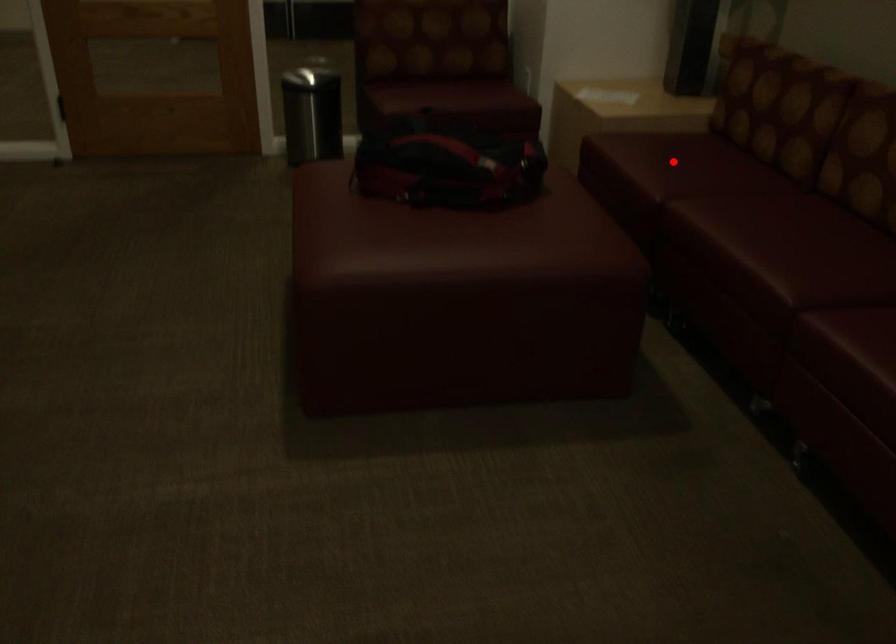
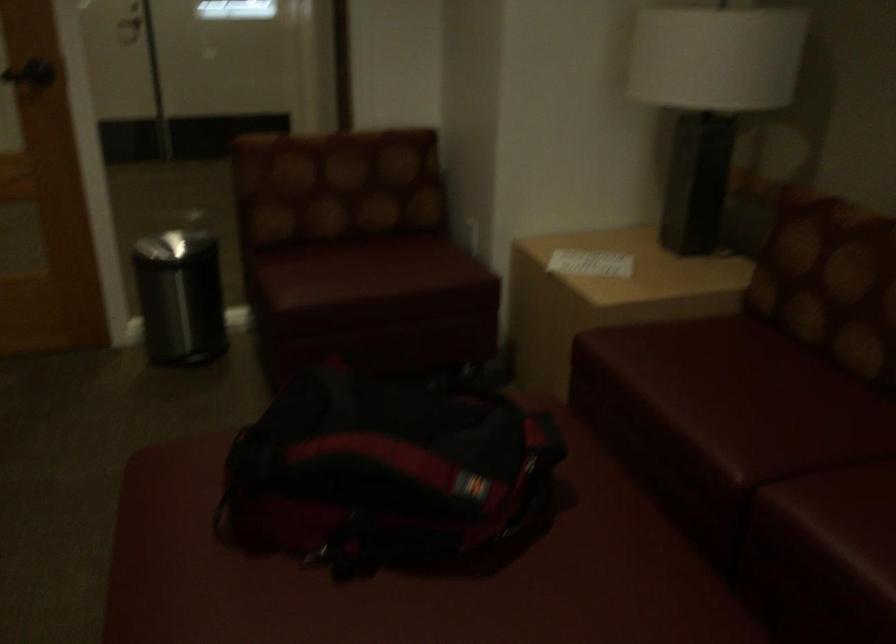
In the second image, find the point that corresponds to the highlighted location in the first image.

(731, 397)